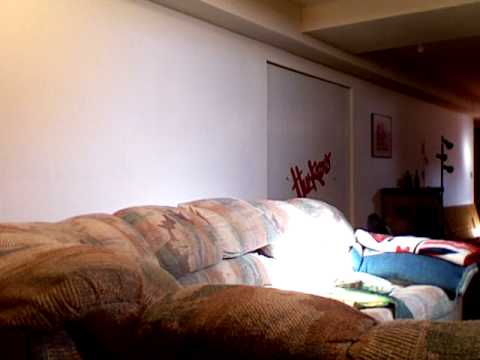
You are a GUI agent. You are given a task and a screenshot of the screen. Output one action in this format:
    pyautogui.click(x=<x>, y=<y>)
    Task: Click on the right side of couch
    Image resolution: width=480 pixels, height=360 pixels.
    Given the screenshot: What is the action you would take?
    pyautogui.click(x=251, y=336)